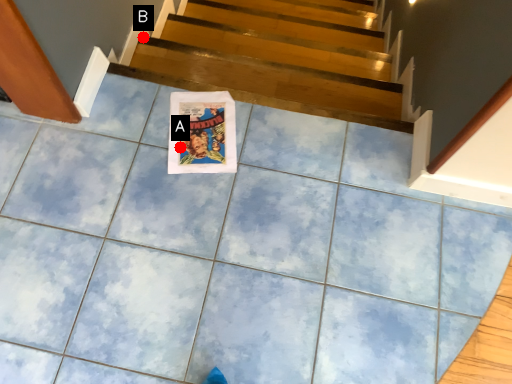
Question: Two points are circled on the image, labeled by A and B beside each circle. Among these points, which one is nearest to the camera?

Choices:
 (A) A is closer
 (B) B is closer

Answer: (A)